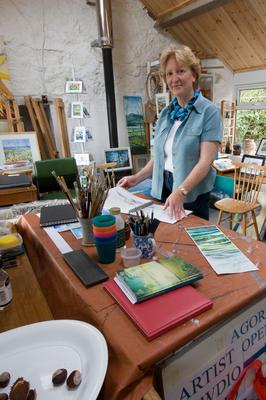
You are a GUI agent. You are given a task and a screenshot of the screen. Output one action in this format:
    pyautogui.click(x=<x>, y=<y>)
    Task: Click on the table cloth
    This screenshot has height=400, width=266.
    Given the screenshot: What is the action you would take?
    pyautogui.click(x=147, y=352)